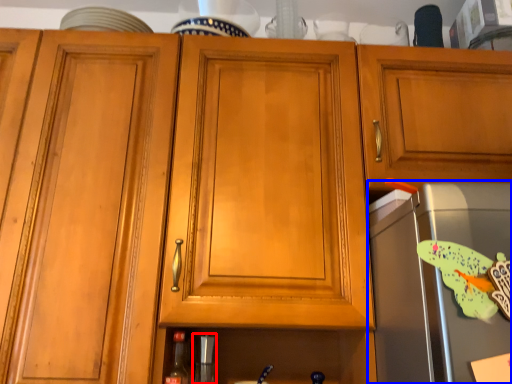
Question: Among these objects, which one is nearest to the camera, appliance (highlighted by a red box) or appliance (highlighted by a blue box)?

Choices:
 (A) appliance
 (B) appliance

Answer: (B)